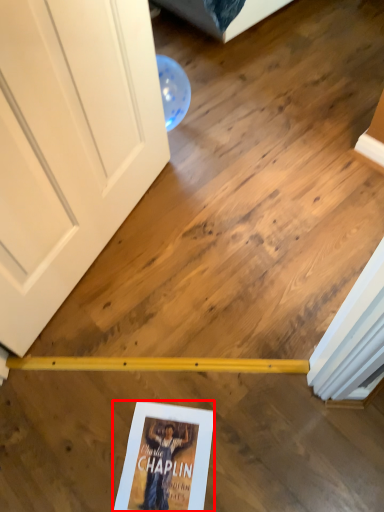
Question: From the image, what is the correct spatial relationship of paperback book (annotated by the red box) in relation to door?

Choices:
 (A) right
 (B) left

Answer: (A)